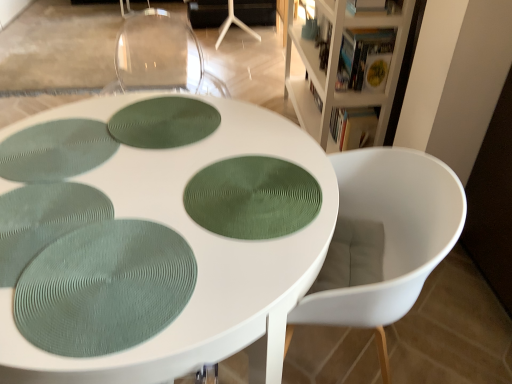
Find the location of `vacant space that is to the left of green textured placemat at center, the 3th oval from the front`. vacant space that is to the left of green textured placemat at center, the 3th oval from the front is located at coordinates (67, 132).